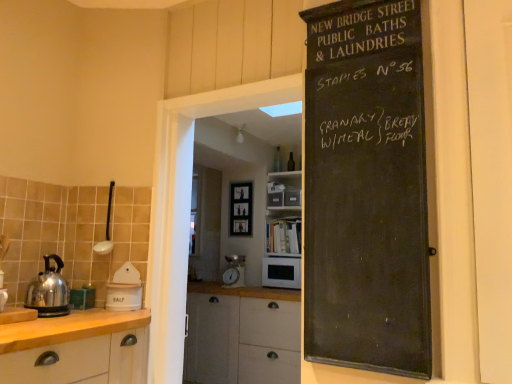
Where is `white ceramic salt container at left, marked as the second appliance in a top-to-bottom arrangement`? white ceramic salt container at left, marked as the second appliance in a top-to-bottom arrangement is located at coordinates (124, 289).

In order to face black chalkboard at right, should I rotate leftwards or rightwards?

Rotate right and turn 13.971 degrees.

The height and width of the screenshot is (384, 512). What do you see at coordinates (49, 290) in the screenshot? I see `polished stainless steel kettle at left` at bounding box center [49, 290].

This screenshot has height=384, width=512. What do you see at coordinates (283, 236) in the screenshot? I see `white wooden shelf at center` at bounding box center [283, 236].

The height and width of the screenshot is (384, 512). In order to click on white wooden shelf at center in this screenshot , I will do `click(283, 236)`.

Identify the location of metallic silver coffee machine at center. (234, 271).

Who is smaller, black chalkboard at right or white ceramic salt container at left, the 1th appliance from the bottom?

white ceramic salt container at left, the 1th appliance from the bottom.

Does black chalkboard at right have a lesser width compared to white ceramic salt container at left, marked as the second appliance in a top-to-bottom arrangement?

Result: Yes.

Consider the image. Which point is more forward, (331,147) or (136,305)?

The point (331,147) is in front.

Which object is more forward, black chalkboard at right or white ceramic salt container at left, the 1th appliance from the bottom?

black chalkboard at right is closer to the camera.

From the image's perspective, does metallic silver coffee machine at center appear lower than white wooden shelf at center?

Yes, from the image's perspective, metallic silver coffee machine at center is below white wooden shelf at center.

Can you tell me how much metallic silver coffee machine at center and white wooden shelf at center differ in facing direction?

0.389 degrees.

Is metallic silver coffee machine at center not near white wooden shelf at center?

They are positioned close to each other.

Can you confirm if metallic silver coffee machine at center is shorter than white wooden shelf at center?

Yes, metallic silver coffee machine at center is shorter than white wooden shelf at center.

Which of these two, black chalkboard at right or white matte cupboard at center, is smaller?

Smaller between the two is black chalkboard at right.

From a real-world perspective, does black chalkboard at right sit lower than white matte cupboard at center?

Result: Actually, black chalkboard at right is physically above white matte cupboard at center in the real world.

Is white matte door at right outside of metallic silver coffee machine at center?

Yes, white matte door at right is not within metallic silver coffee machine at center.

From a real-world perspective, which object rests below the other?

metallic silver coffee machine at center, from a real-world perspective.

Which point is more distant from viewer, (505,247) or (226,270)?

The point (226,270) is more distant.

How many degrees apart are the facing directions of white matte door at right and metallic silver coffee machine at center?

white matte door at right and metallic silver coffee machine at center are facing 1.22 degrees away from each other.

Is polished stainless steel kettle at left oriented away from black chalkboard at right?

polished stainless steel kettle at left is not turned away from black chalkboard at right.

Is black chalkboard at right completely or partially inside polished stainless steel kettle at left?

No.

Is point (26, 300) positioned before point (327, 157)?

That is False.

Is polished stainless steel kettle at left in front of black chalkboard at right?

No, it is behind black chalkboard at right.

What's the angular difference between white glossy spoon at left, which ranks as the first appliance in top-to-bottom order, and white matte door at right's facing directions?

The angle between the facing direction of white glossy spoon at left, which ranks as the first appliance in top-to-bottom order, and the facing direction of white matte door at right is 23.5 degrees.

Is white glossy spoon at left, which ranks as the first appliance in top-to-bottom order, taller or shorter than white matte door at right?

In the image, white glossy spoon at left, which ranks as the first appliance in top-to-bottom order, appears to be shorter than white matte door at right.

Is white glossy spoon at left, which ranks as the first appliance in top-to-bottom order, aimed at white matte door at right?

No, white glossy spoon at left, which ranks as the first appliance in top-to-bottom order, does not turn towards white matte door at right.

Can we say white glossy spoon at left, which ranks as the 2th appliance in bottom-to-top order, lies outside white matte door at right?

Absolutely, white glossy spoon at left, which ranks as the 2th appliance in bottom-to-top order, is external to white matte door at right.

Is metallic silver coffee machine at center thinner than white ceramic salt container at left, marked as the second appliance in a top-to-bottom arrangement?

In fact, metallic silver coffee machine at center might be wider than white ceramic salt container at left, marked as the second appliance in a top-to-bottom arrangement.

From a real-world perspective, is metallic silver coffee machine at center physically located above or below white ceramic salt container at left, the 1th appliance from the bottom?

From a real-world perspective, metallic silver coffee machine at center is physically above white ceramic salt container at left, the 1th appliance from the bottom.

Is metallic silver coffee machine at center oriented towards white ceramic salt container at left, marked as the second appliance in a top-to-bottom arrangement?

Yes, metallic silver coffee machine at center is aimed at white ceramic salt container at left, marked as the second appliance in a top-to-bottom arrangement.

There is a white ceramic salt container at left, the 1th appliance from the bottom. Identify the location of bulletin board above it (from a real-world perspective). (366, 189).

I want to click on shelf behind the metallic silver coffee machine at center, so click(x=283, y=236).

Considering their positions, is black chalkboard at right positioned further to white glossy microwave at center than white matte cabinet at left?

Among the two, black chalkboard at right is located further to white glossy microwave at center.

Considering their positions, is polished stainless steel kettle at left positioned closer to white wooden shelf at center than metallic silver coffee machine at center?

metallic silver coffee machine at center.

Considering their positions, is white ceramic salt container at left, marked as the second appliance in a top-to-bottom arrangement, positioned closer to polished stainless steel kettle at left than white glossy spoon at left, which ranks as the 2th appliance in bottom-to-top order?

white ceramic salt container at left, marked as the second appliance in a top-to-bottom arrangement, is positioned closer to the anchor polished stainless steel kettle at left.

Estimate the real-world distances between objects in this image. Which object is closer to metallic silver coffee machine at center, polished stainless steel kettle at left or white glossy microwave at center?

Based on the image, white glossy microwave at center appears to be nearer to metallic silver coffee machine at center.

From the image, which object appears to be nearer to polished stainless steel kettle at left, white matte door at right or metallic silver coffee machine at center?

white matte door at right is positioned closer to the anchor polished stainless steel kettle at left.

Considering their positions, is metallic silver coffee machine at center positioned further to white glossy microwave at center than black chalkboard at right?

black chalkboard at right is positioned further to the anchor white glossy microwave at center.

When comparing their distances from white matte cabinet at left, does metallic silver coffee machine at center or white glossy microwave at center seem closer?

The object closer to white matte cabinet at left is white glossy microwave at center.

Estimate the real-world distances between objects in this image. Which object is closer to white matte door at right, white matte cabinet at left or white glossy microwave at center?

white matte cabinet at left is closer to white matte door at right.

What are the coordinates of `kettle positioned between white matte door at right and white matte cupboard at center from near to far` in the screenshot? It's located at (49, 290).

What are the coordinates of `cupboard located between polished stainless steel kettle at left and white glossy microwave at center in the depth direction` in the screenshot? It's located at (238, 330).

I want to click on microwave between white glossy spoon at left, which ranks as the first appliance in top-to-bottom order, and metallic silver coffee machine at center, along the z-axis, so [281, 272].

This screenshot has width=512, height=384. Identify the location of cupboard located between white matte door at right and white glossy microwave at center in the depth direction. (238, 330).